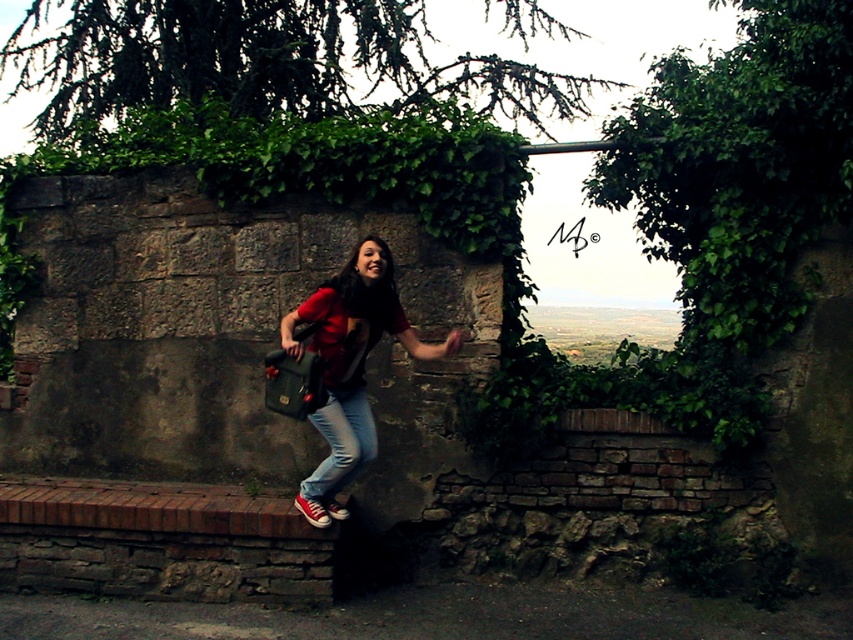
Question: Does matte red shirt at center lie behind jeans at center?

Choices:
 (A) no
 (B) yes

Answer: (A)

Question: Which point appears closest to the camera in this image?

Choices:
 (A) (372, 444)
 (B) (358, 401)

Answer: (A)

Question: Among these objects, which one is nearest to the camera?

Choices:
 (A) jeans at center
 (B) matte red shirt at center

Answer: (B)

Question: Is matte red shirt at center above jeans at center?

Choices:
 (A) no
 (B) yes

Answer: (B)

Question: Can you confirm if matte red shirt at center is wider than jeans at center?

Choices:
 (A) yes
 (B) no

Answer: (A)